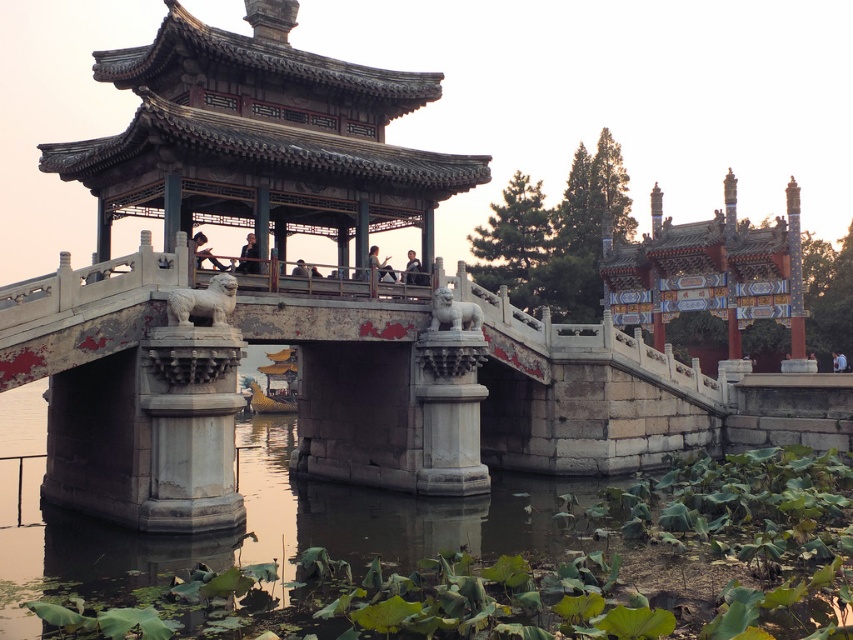
Does white stone bridge at center have a smaller size compared to light brown wooden bench at center?

No.

Between white stone bridge at center and light brown wooden bench at center, which one is positioned higher?

light brown wooden bench at center is above.

Image resolution: width=853 pixels, height=640 pixels. Find the location of `white stone bridge at center`. white stone bridge at center is located at coordinates (584, 396).

Between stone gazebo at center and light brown wooden bridge at center, which one has more height?

stone gazebo at center is taller.

In the scene shown: Is stone gazebo at center thinner than light brown wooden bridge at center?

Incorrect, stone gazebo at center's width is not less than light brown wooden bridge at center's.

Does point (248, 122) lie in front of point (368, 257)?

Yes.

Where is `stone gazebo at center`? The height and width of the screenshot is (640, 853). stone gazebo at center is located at coordinates (260, 141).

Does stone gazebo at center appear over matte black shirt at upper center?

No, stone gazebo at center is not above matte black shirt at upper center.

Which is behind, point (51, 388) or point (199, 237)?

The point (199, 237) is behind.

Locate an element on the screen. The image size is (853, 640). stone gazebo at center is located at coordinates (260, 141).